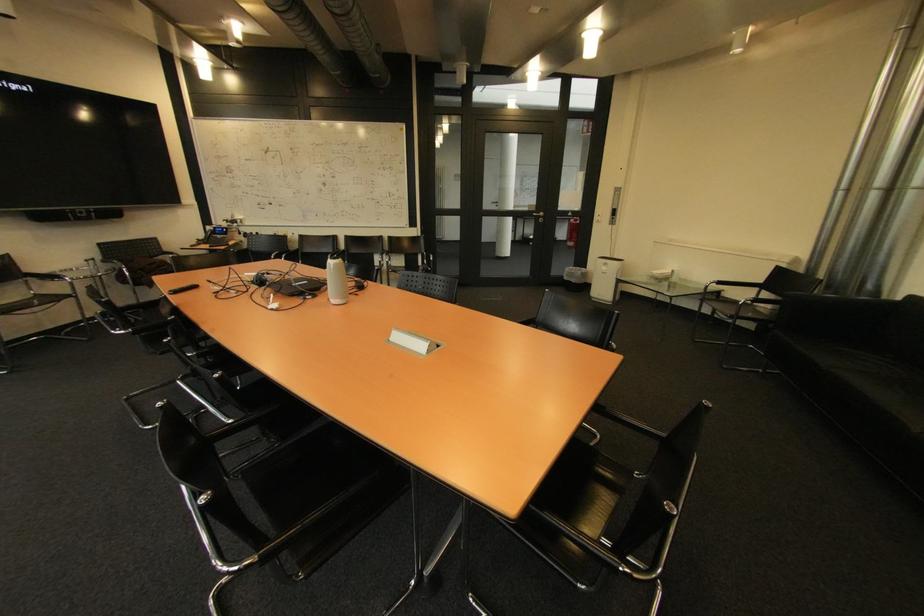
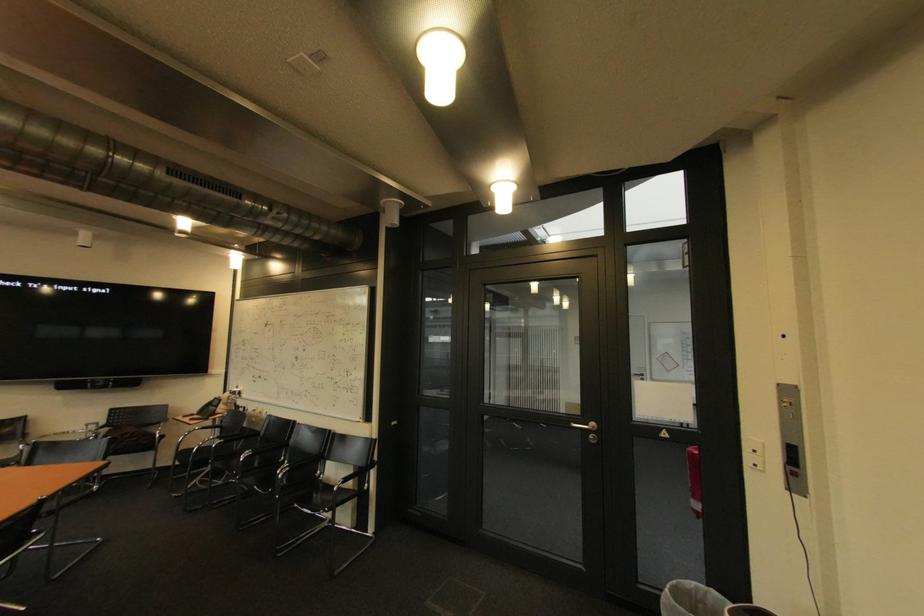
In the second image, find the point that corresponds to the point at 603,220 in the first image.

(757, 459)